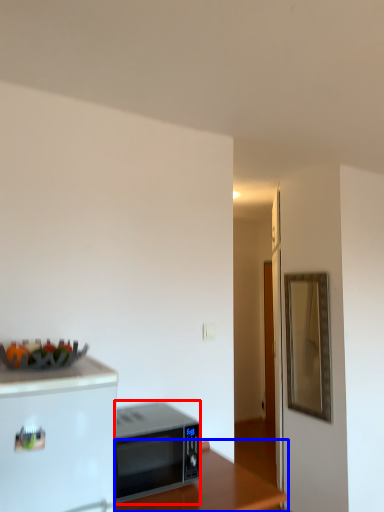
Question: Among these objects, which one is nearest to the camera, microwave oven (highlighted by a red box) or table (highlighted by a blue box)?

Choices:
 (A) microwave oven
 (B) table

Answer: (B)